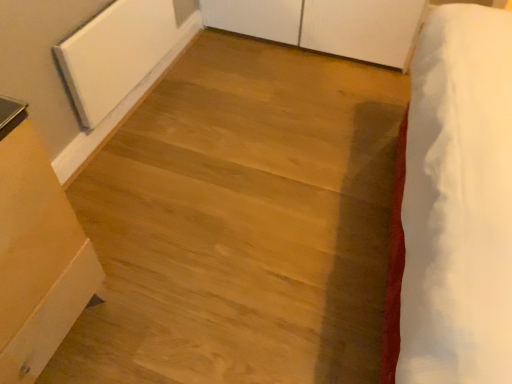
This screenshot has height=384, width=512. Describe the element at coordinates (37, 253) in the screenshot. I see `light wood table at left` at that location.

Where is `light wood table at left`? The width and height of the screenshot is (512, 384). light wood table at left is located at coordinates (37, 253).

I want to click on light wood table at left, so click(x=37, y=253).